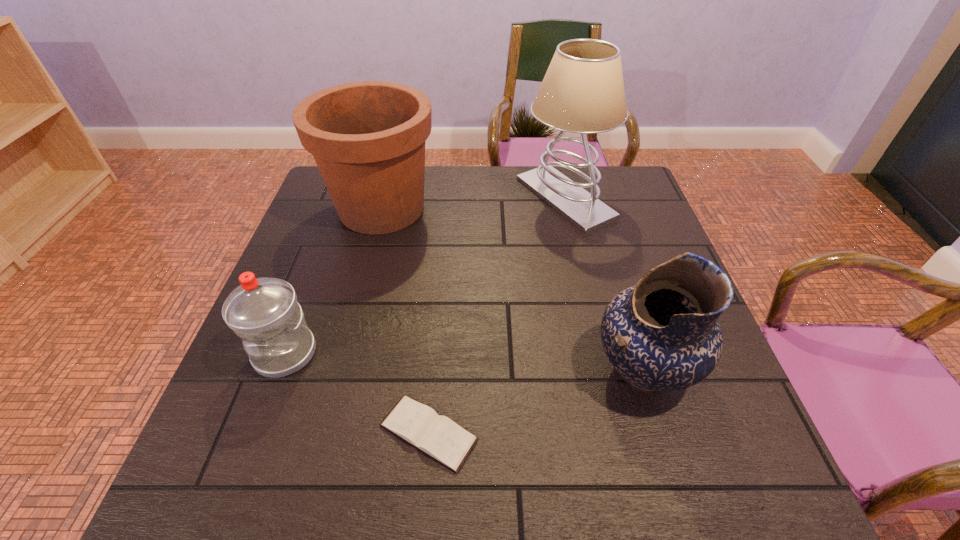
You are a GUI agent. You are given a task and a screenshot of the screen. Output one action in this format:
    pyautogui.click(x=<x>, y=<y>)
    Task: Click on the tallest object
    This screenshot has height=540, width=960.
    Given the screenshot: What is the action you would take?
    pyautogui.click(x=582, y=92)

This screenshot has width=960, height=540. Identify the location of flowerpot. (368, 138).

You are a GUI agent. You are given a task and a screenshot of the screen. Output one action in this format:
    pyautogui.click(x=<x>, y=<y>)
    Task: Click on the pottery
    
    Given the screenshot: What is the action you would take?
    pyautogui.click(x=663, y=334)

You are a GUI agent. You are given a task and a screenshot of the screen. Output one action in this format:
    pyautogui.click(x=<x>, y=<y>)
    Task: Click on the water bottle
    The image size is (960, 540).
    Given the screenshot: What is the action you would take?
    pyautogui.click(x=264, y=312)

Image resolution: width=960 pixels, height=540 pixels. What are the coordinates of `diary` in the screenshot? It's located at (439, 437).

The image size is (960, 540). In order to click on vacant space located 0.260m on the front of the table lamp in this screenshot , I will do `click(589, 305)`.

Where is `free space located on the front of the flowerpot`? free space located on the front of the flowerpot is located at coordinates [352, 322].

This screenshot has width=960, height=540. In order to click on vacant point located on the back of the pottery in this screenshot , I will do `click(612, 270)`.

Where is `free space located on the handle side of the second shortest object`? Image resolution: width=960 pixels, height=540 pixels. free space located on the handle side of the second shortest object is located at coordinates (250, 448).

At what (x,y) coordinates should I click in order to perform the action: click on free spot located on the right of the shortest object. Please return your answer as a coordinate pair (x, y). Looking at the image, I should click on (659, 433).